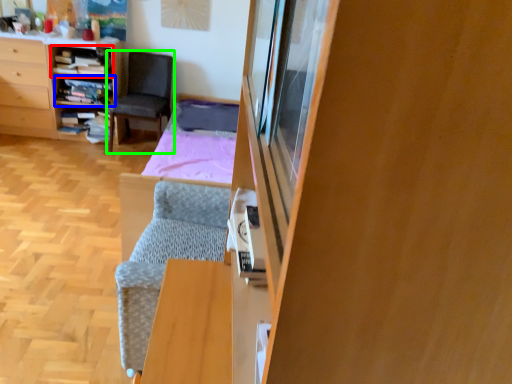
Question: Estimate the real-world distances between objects in this image. Which object is closer to shelf (highlighted by a red box), shelf (highlighted by a blue box) or chair (highlighted by a green box)?

Choices:
 (A) shelf
 (B) chair

Answer: (A)